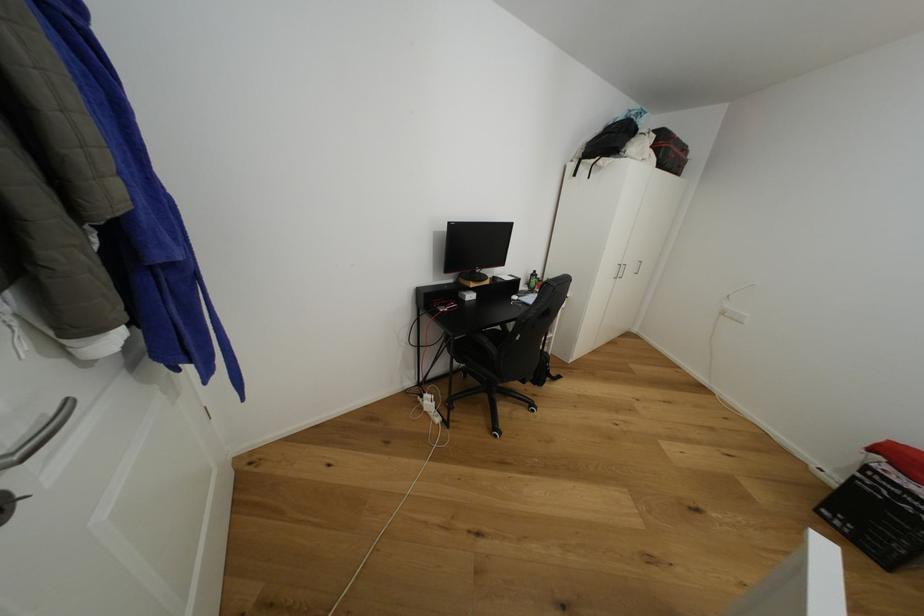
The location [669,151] corresponds to which object?

This point indicates the black backpack.